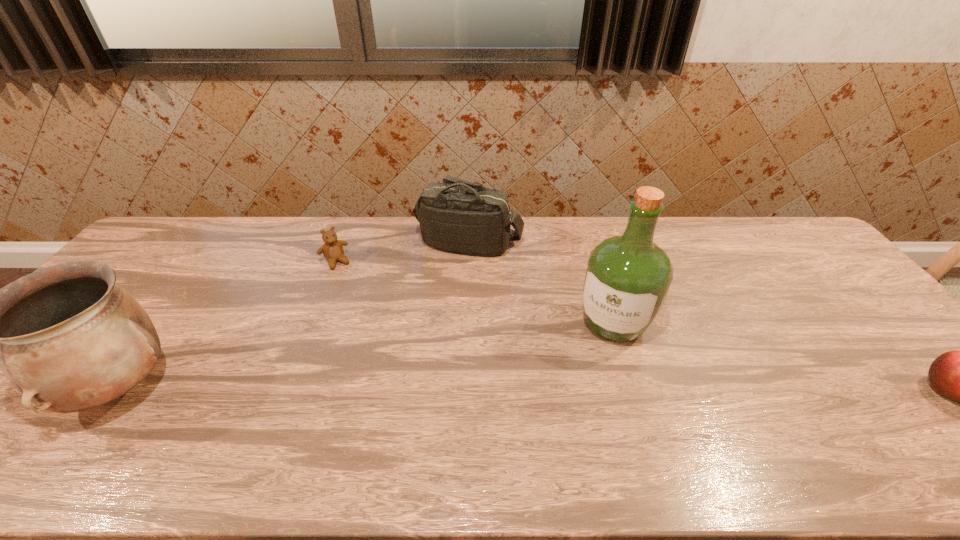
Where is `free space located 0.270m at the front padded panel of the shoulder bag`? This screenshot has height=540, width=960. free space located 0.270m at the front padded panel of the shoulder bag is located at coordinates (470, 324).

Where is `vacant space situated at the front padded panel of the shoulder bag`? vacant space situated at the front padded panel of the shoulder bag is located at coordinates (470, 314).

The width and height of the screenshot is (960, 540). In order to click on free space located at the front padded panel of the shoulder bag in this screenshot , I will do `click(470, 314)`.

Image resolution: width=960 pixels, height=540 pixels. In order to click on free spot located on the front-facing side of the tallest object in this screenshot , I will do `click(562, 427)`.

Image resolution: width=960 pixels, height=540 pixels. In order to click on vacant position located on the front-facing side of the tallest object in this screenshot , I will do `click(593, 364)`.

Where is `vacant space located on the front-facing side of the tallest object`? This screenshot has width=960, height=540. vacant space located on the front-facing side of the tallest object is located at coordinates (566, 416).

Locate an element on the screen. This screenshot has width=960, height=540. teddy bear located at the far edge is located at coordinates (332, 249).

The width and height of the screenshot is (960, 540). What are the coordinates of `shoulder bag that is at the far edge` in the screenshot? It's located at (458, 216).

Where is `object that is at the near edge`? This screenshot has height=540, width=960. object that is at the near edge is located at coordinates (69, 338).

Image resolution: width=960 pixels, height=540 pixels. Find the location of `object present at the left edge`. object present at the left edge is located at coordinates (69, 338).